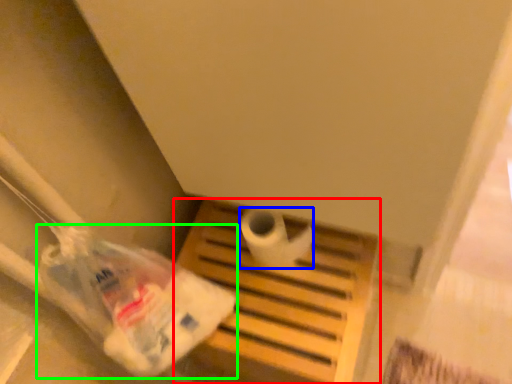
Question: Which object is the closest to the furniture (highlighted by a red box)? Choose among these: toilet paper (highlighted by a blue box) or plastic bag (highlighted by a green box).

Choices:
 (A) toilet paper
 (B) plastic bag

Answer: (A)